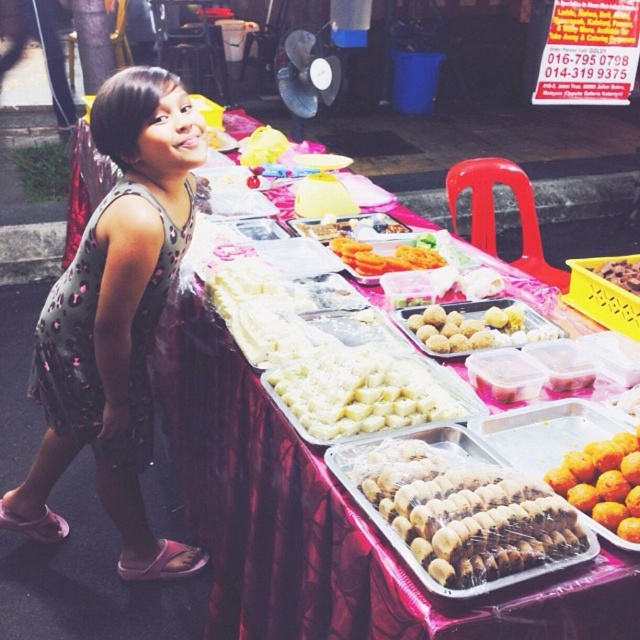
Question: Is golden brown doughnut at center to the left of brown matte cookies at center from the viewer's perspective?

Choices:
 (A) yes
 (B) no

Answer: (A)

Question: Among these points, which one is farthest from the camera?

Choices:
 (A) (67, 316)
 (B) (612, 515)
 (C) (353, 244)
 (D) (275, 396)

Answer: (C)

Question: Is printed fabric dress at left below golden brown doughnut at center?

Choices:
 (A) yes
 (B) no

Answer: (B)

Question: Among these objects, which one is nearest to the camera?

Choices:
 (A) printed fabric dress at left
 (B) golden brown doughnut at center
 (C) orange matte carrot at center
 (D) orange matte/orange matte/orange matte/orange matte/orange matte/orange matte/orange matte/orange matte/orange matte/orange matte/orange matte/orange matte/orange matte/orange matte/orange matte/orange matte/orange matte/orange matte/orange matte/orange matte/orange matte/orange matte/orange matte/orange matte/orange matte/orange matte/orange matte/orange matte/orange matte/orange matte/orange matte/orange matte/orange matte/orange matte/orange matte/orange matte/orange matte/orange matte/orange matte/orange matte/orange matte/orange matte/orange matte

Answer: (D)

Question: Which object appears closest to the camera in this image?

Choices:
 (A) golden brown doughnut at center
 (B) shiny plastic cookies at center
 (C) brown matte cookies at center
 (D) white matte pastry at center

Answer: (B)

Question: Does orange matte carrot at center have a larger size compared to brown matte cookies at center?

Choices:
 (A) yes
 (B) no

Answer: (A)